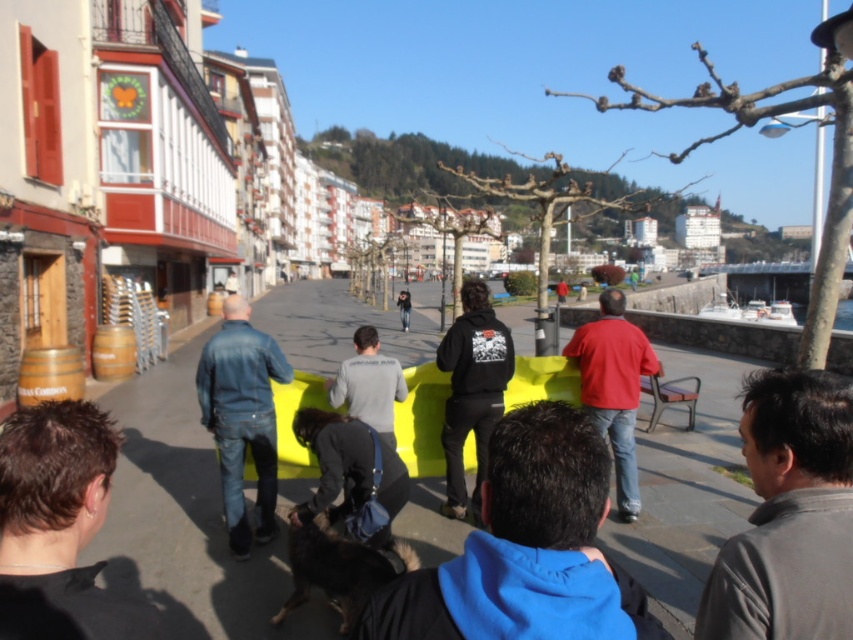
You are a photographer trying to capture both the matte red sweatshirt at center and the metallic brown chair at right in a single frame. Given their sizes, which object should you focus on to ensure both are clearly visible in your photo?

The matte red sweatshirt at center is smaller than the metallic brown chair at right, so you should focus on the metallic brown chair at right to ensure both objects are clearly visible in the photo.

You are a delivery person who needs to place a new package on the surface of the metallic brown chair at right. However, the package is as thick as the matte red sweatshirt at center. Will the package fit on the chair?

The matte red sweatshirt at center is thinner than the metallic brown chair at right. Since the package is as thick as the matte red sweatshirt at center, it will fit on the metallic brown chair at right because the chair is thicker and can accommodate the package.

You are a photographer trying to capture a shot of the gray matte shirt at lower right and the denim jacket at left. Which object is positioned lower in the image?

The gray matte shirt at lower right is positioned below the denim jacket at left, so it is lower in the image.